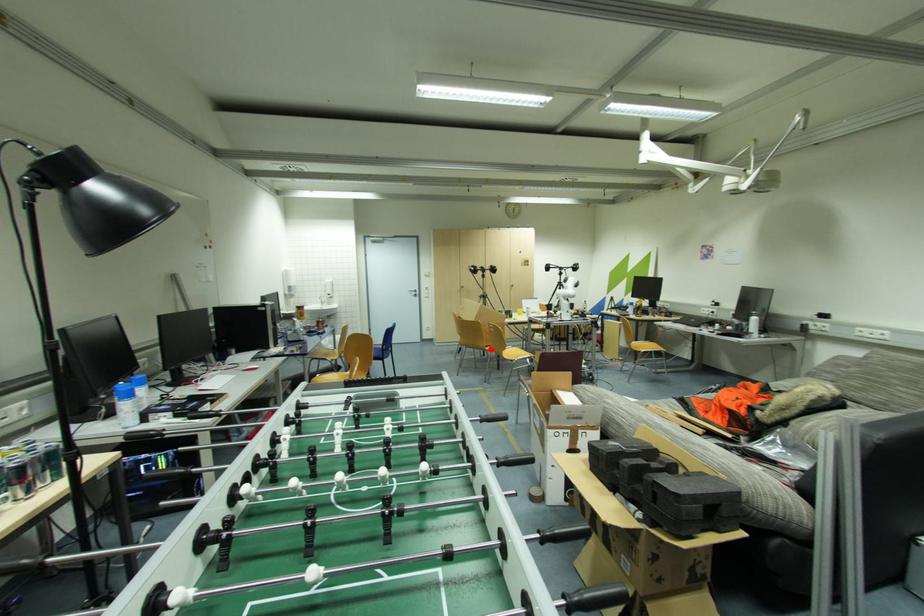
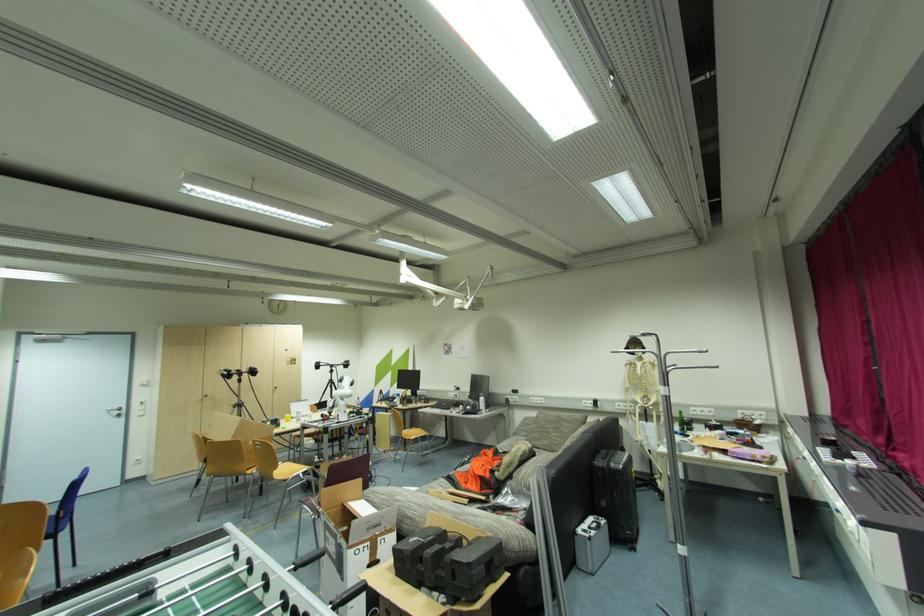
Where in the second image is the point corresponding to the highlighted location from the first image?

(252, 472)